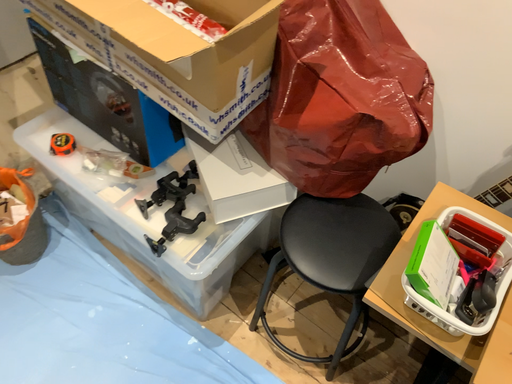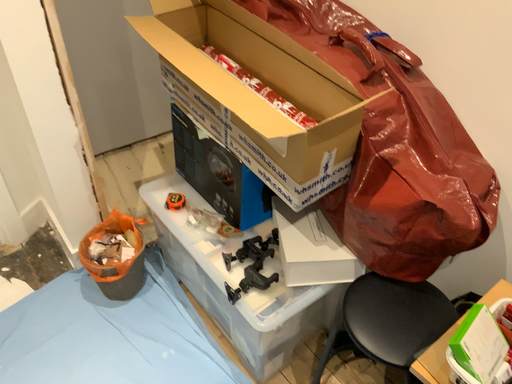
Question: How did the camera likely rotate when shooting the video?

Choices:
 (A) rotated downward
 (B) rotated upward

Answer: (B)